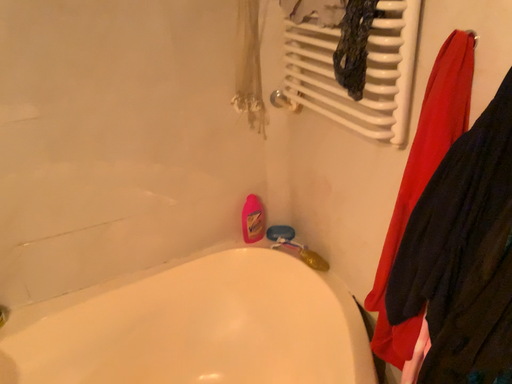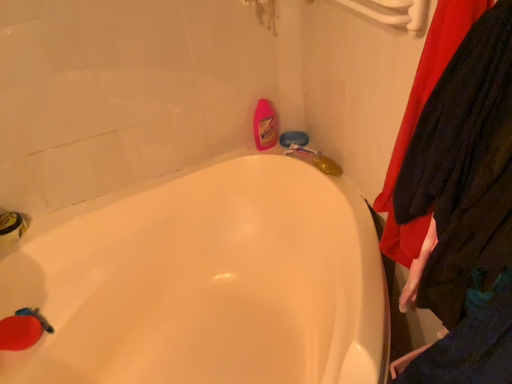
Question: Which way did the camera rotate in the video?

Choices:
 (A) rotated upward
 (B) rotated downward

Answer: (B)